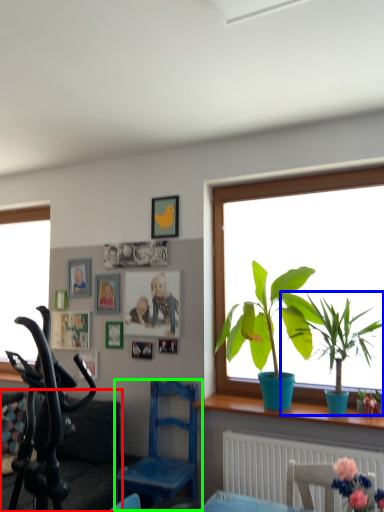
Question: Which object is the closest to the couch (highlighted by a red box)? Choose among these: houseplant (highlighted by a blue box) or chair (highlighted by a green box).

Choices:
 (A) houseplant
 (B) chair

Answer: (B)